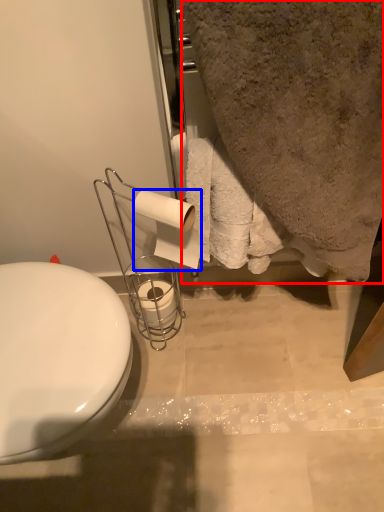
Question: Which object appears farthest to the camera in this image, bath towel (highlighted by a red box) or toilet paper (highlighted by a blue box)?

Choices:
 (A) bath towel
 (B) toilet paper

Answer: (B)